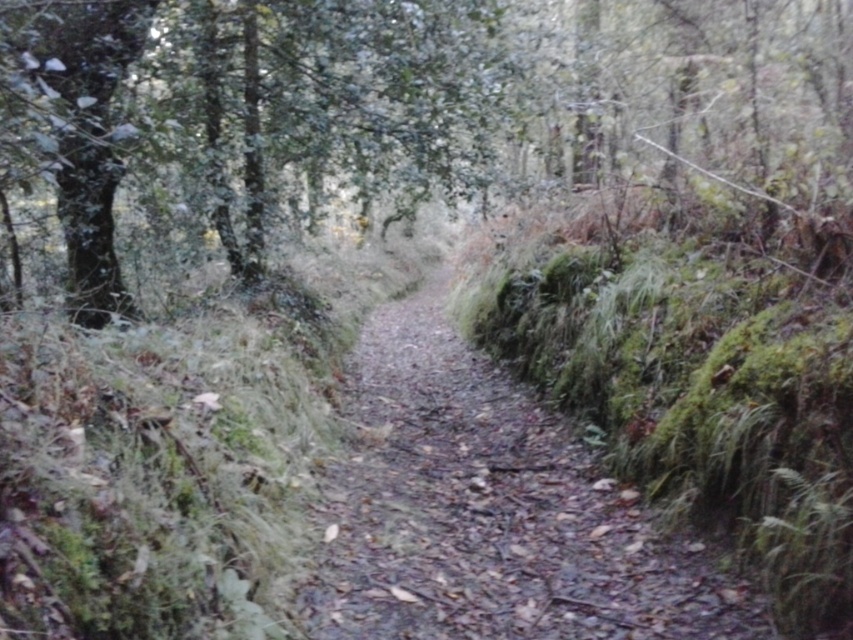
Question: Estimate the real-world distances between objects in this image. Which object is farther from the damp dirt path at center?

Choices:
 (A) green mossy tree at upper left
 (B) green mossy tree at center

Answer: (A)

Question: Which point appears farthest from the camera in this image?

Choices:
 (A) pos(517,113)
 (B) pos(102,140)
 (C) pos(387,464)

Answer: (A)

Question: Is damp dirt path at center to the left of green mossy tree at upper left from the viewer's perspective?

Choices:
 (A) no
 (B) yes

Answer: (A)

Question: Does green mossy tree at center have a larger size compared to damp dirt path at center?

Choices:
 (A) yes
 (B) no

Answer: (A)

Question: Which point is farther from the camera taking this photo?

Choices:
 (A) (339, 580)
 (B) (68, 214)
 (C) (561, 16)

Answer: (C)

Question: Does green mossy tree at center appear over damp dirt path at center?

Choices:
 (A) yes
 (B) no

Answer: (A)